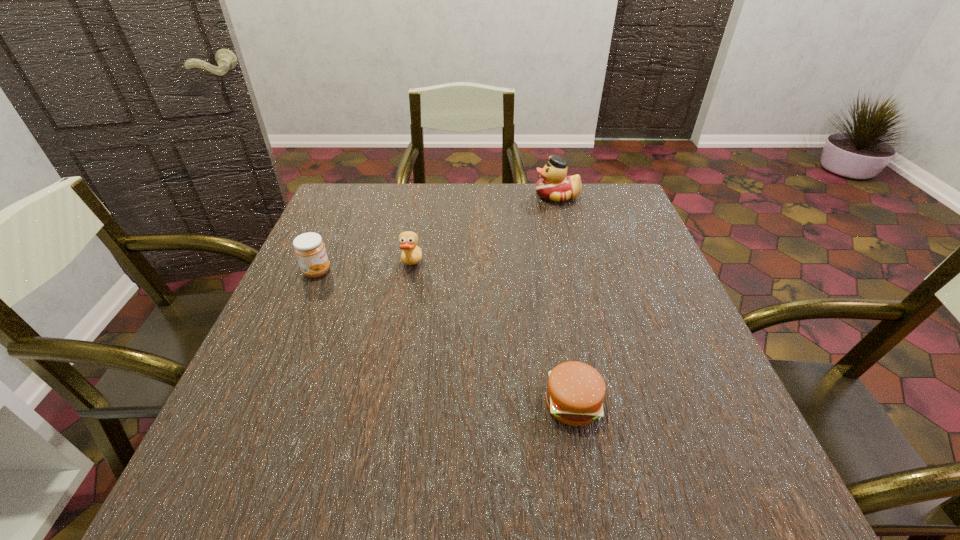
Identify the location of vacant space at the far left corner of the desktop. The height and width of the screenshot is (540, 960). (353, 197).

The height and width of the screenshot is (540, 960). What are the coordinates of `vacant area at the near left corner` in the screenshot? It's located at (282, 490).

Locate an element on the screen. vacant space at the far right corner of the desktop is located at coordinates (626, 226).

The height and width of the screenshot is (540, 960). Identify the location of vacant space at the near right corner. (680, 487).

At what (x,y) coordinates should I click in order to perform the action: click on free area in between the farther duck and the nearest object. Please return your answer as a coordinate pair (x, y). Image resolution: width=960 pixels, height=540 pixels. Looking at the image, I should click on (564, 300).

Where is `vacant area that lies between the third object from right to left and the leftmost object`? This screenshot has width=960, height=540. vacant area that lies between the third object from right to left and the leftmost object is located at coordinates (364, 269).

You are a GUI agent. You are given a task and a screenshot of the screen. Output one action in this format:
    pyautogui.click(x=<x>, y=<y>)
    Task: Click on the free space that is in between the taller duck and the hamburger
    The image size is (960, 540).
    Given the screenshot: What is the action you would take?
    pyautogui.click(x=564, y=300)

Identify the location of vacant area between the right duck and the jam. The image size is (960, 540). (437, 234).

You are a GUI agent. You are given a task and a screenshot of the screen. Output one action in this format:
    pyautogui.click(x=<x>, y=<y>)
    Task: Click on the vacant space in between the tallest object and the jam
    This screenshot has width=960, height=540.
    Given the screenshot: What is the action you would take?
    pyautogui.click(x=437, y=234)

Locate an element on the screen. The height and width of the screenshot is (540, 960). empty space that is in between the jam and the tallest object is located at coordinates (437, 234).